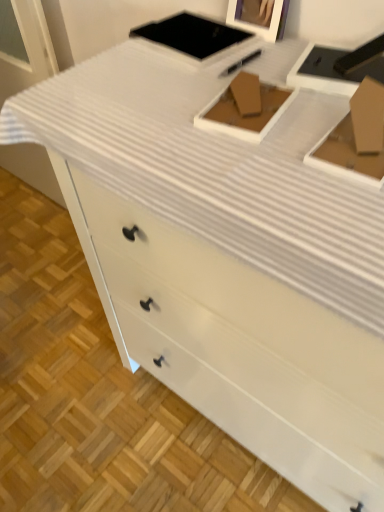
Question: Is there a large distance between brown cardboard box at center and wooden picture frame at upper center?

Choices:
 (A) no
 (B) yes

Answer: (A)

Question: Is brown cardboard box at center directly adjacent to wooden picture frame at upper center?

Choices:
 (A) yes
 (B) no

Answer: (B)

Question: Is brown cardboard box at center facing away from wooden picture frame at upper center?

Choices:
 (A) no
 (B) yes

Answer: (A)

Question: Is brown cardboard box at center facing towards wooden picture frame at upper center?

Choices:
 (A) no
 (B) yes

Answer: (A)

Question: Does brown cardboard box at center have a smaller size compared to wooden picture frame at upper center?

Choices:
 (A) no
 (B) yes

Answer: (B)

Question: Is wooden picture frame at upper center inside brown cardboard box at center?

Choices:
 (A) yes
 (B) no

Answer: (B)

Question: Is wooden picture frame at upper center turned away from brown cardboard box at center?

Choices:
 (A) no
 (B) yes

Answer: (A)

Question: From the image's perspective, is wooden picture frame at upper center beneath brown cardboard box at center?

Choices:
 (A) no
 (B) yes

Answer: (A)

Question: From a real-world perspective, is wooden picture frame at upper center positioned under brown cardboard box at center based on gravity?

Choices:
 (A) yes
 (B) no

Answer: (B)

Question: Does wooden picture frame at upper center have a lesser width compared to brown cardboard box at center?

Choices:
 (A) no
 (B) yes

Answer: (B)

Question: Is wooden picture frame at upper center not near brown cardboard box at center?

Choices:
 (A) no
 (B) yes

Answer: (A)

Question: From a real-world perspective, is wooden picture frame at upper center positioned over brown cardboard box at center based on gravity?

Choices:
 (A) yes
 (B) no

Answer: (A)

Question: Based on their positions, is brown cardboard box at center located to the left or right of wooden picture frame at upper center?

Choices:
 (A) right
 (B) left

Answer: (B)